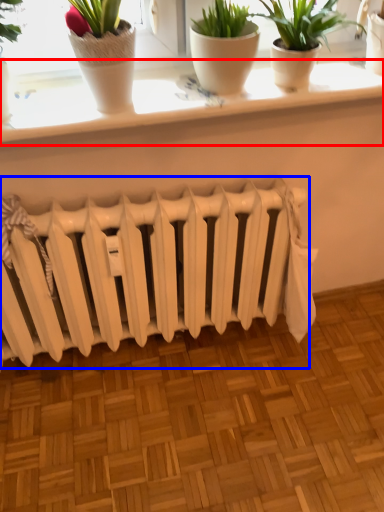
Question: Among these objects, which one is farthest to the camera, window sill (highlighted by a red box) or radiator (highlighted by a blue box)?

Choices:
 (A) window sill
 (B) radiator

Answer: (B)